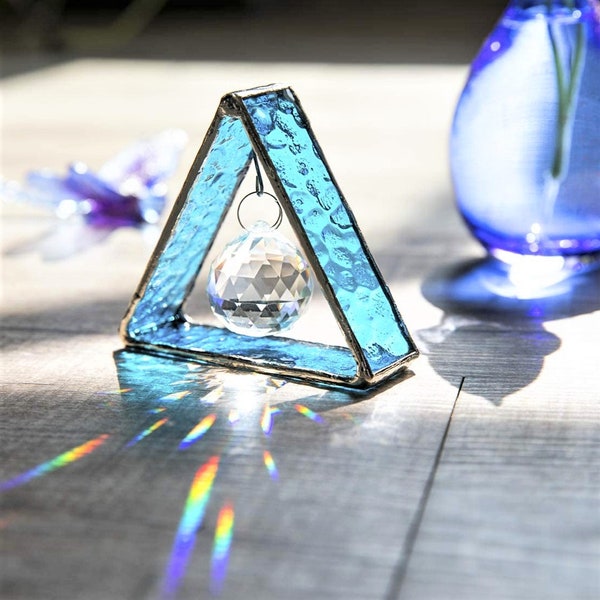
The width and height of the screenshot is (600, 600). I want to click on crystal ball, so click(x=263, y=282).